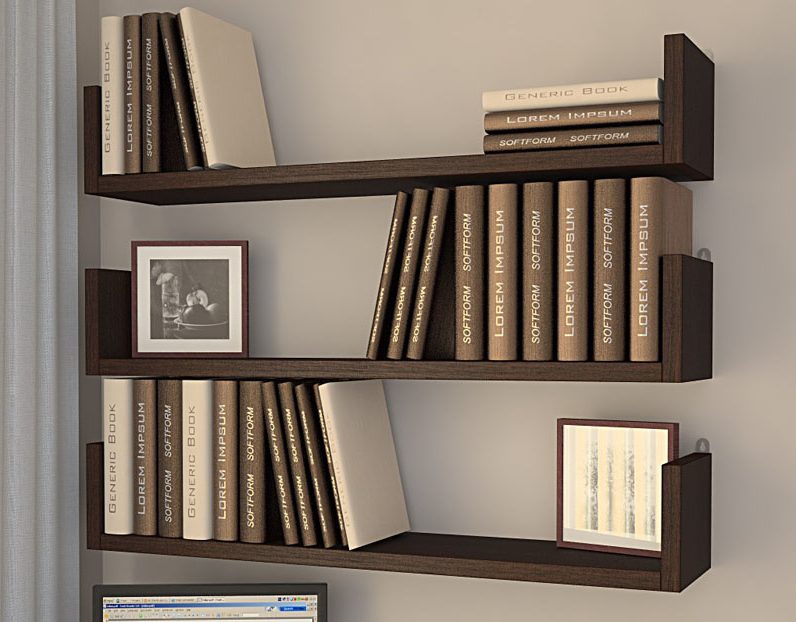
This screenshot has height=622, width=796. What are the coordinates of `books on bottom shelf` in the screenshot? It's located at (115, 448), (137, 448), (164, 443), (190, 448), (220, 461), (247, 476), (281, 486), (295, 491), (315, 496), (334, 499).